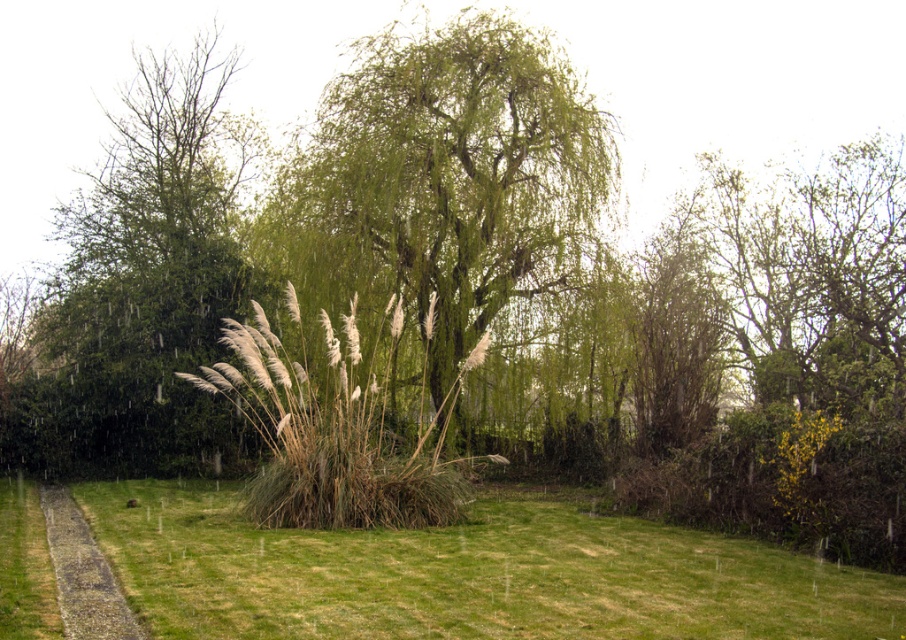
Question: Does green leafy willow at center have a larger size compared to green leafy tree at left?

Choices:
 (A) yes
 (B) no

Answer: (B)

Question: From the image, what is the correct spatial relationship of green grass at center in relation to gravelly path at lower left?

Choices:
 (A) left
 (B) right

Answer: (B)

Question: Which is farther from the green leafy tree at left?

Choices:
 (A) gravelly path at lower left
 (B) brown grassy reed at center
 (C) green grass at center

Answer: (B)

Question: Which point is farther to the camera?

Choices:
 (A) (581, 209)
 (B) (255, 129)
 (C) (396, 506)
 (D) (68, 496)

Answer: (B)

Question: Which point appears closest to the camera in this image?

Choices:
 (A) (75, 568)
 (B) (432, 80)

Answer: (A)

Question: Does green grass at center appear under gravelly path at lower left?

Choices:
 (A) no
 (B) yes

Answer: (B)